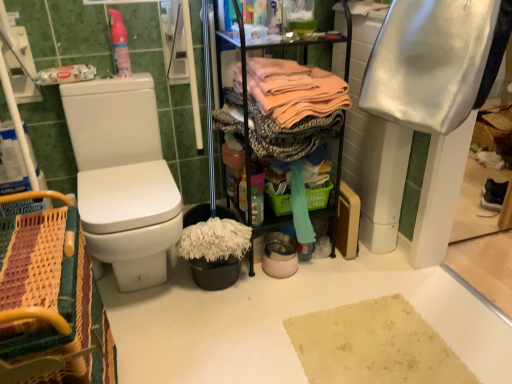
I want to click on vacant space in white glossy toilet at left (from a real-world perspective), so click(147, 288).